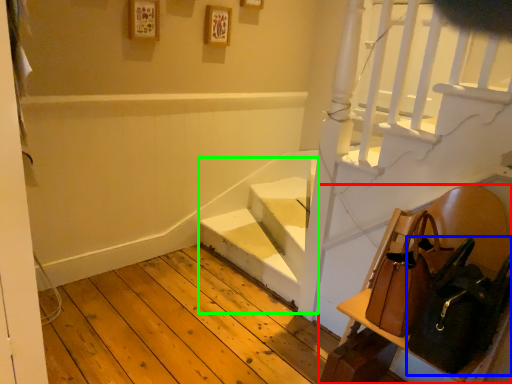
Question: Which object is positioned closest to furniture (highlighted by a red box)? Select from shoulder bag (highlighted by a blue box) and stairwell (highlighted by a green box).

Choices:
 (A) shoulder bag
 (B) stairwell

Answer: (A)